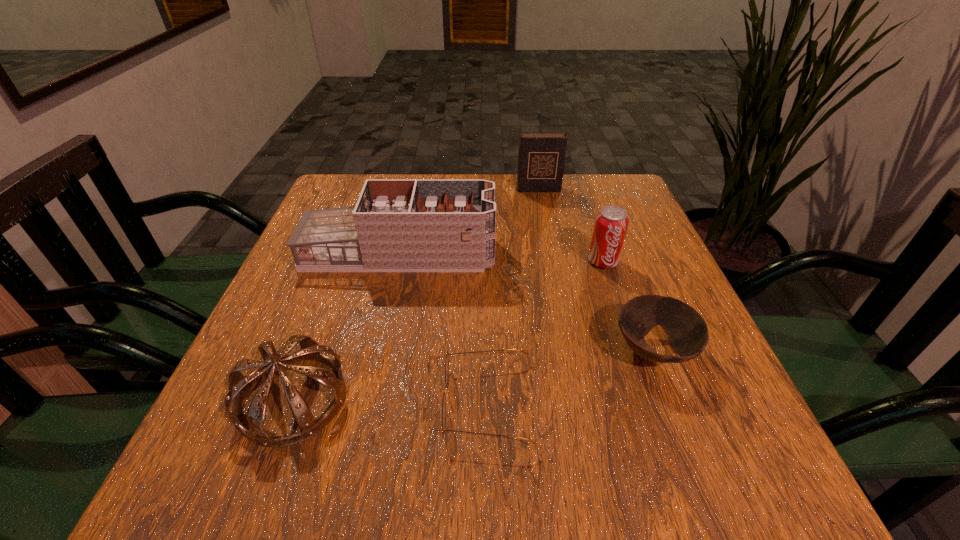
Locate an element on the screen. soda can that is at the right edge is located at coordinates (611, 223).

The height and width of the screenshot is (540, 960). What are the coordinates of `bowl that is at the right edge` in the screenshot? It's located at (687, 331).

Identify the location of object at the near left corner. (238, 384).

This screenshot has width=960, height=540. I want to click on free space at the far edge of the desktop, so click(565, 201).

In the image, there is a desktop. Where is `blank space at the near edge`? The image size is (960, 540). blank space at the near edge is located at coordinates (504, 462).

This screenshot has height=540, width=960. Identify the location of free region at the left edge of the desktop. pyautogui.click(x=345, y=330).

This screenshot has height=540, width=960. I want to click on vacant space at the right edge of the desktop, so click(640, 356).

Where is `free space at the far left corner`? free space at the far left corner is located at coordinates (357, 195).

In the image, there is a desktop. Where is `vacant region at the near left corner`? Image resolution: width=960 pixels, height=540 pixels. vacant region at the near left corner is located at coordinates (264, 467).

This screenshot has height=540, width=960. In the image, there is a desktop. Find the location of `free space at the far right corner`. free space at the far right corner is located at coordinates (630, 195).